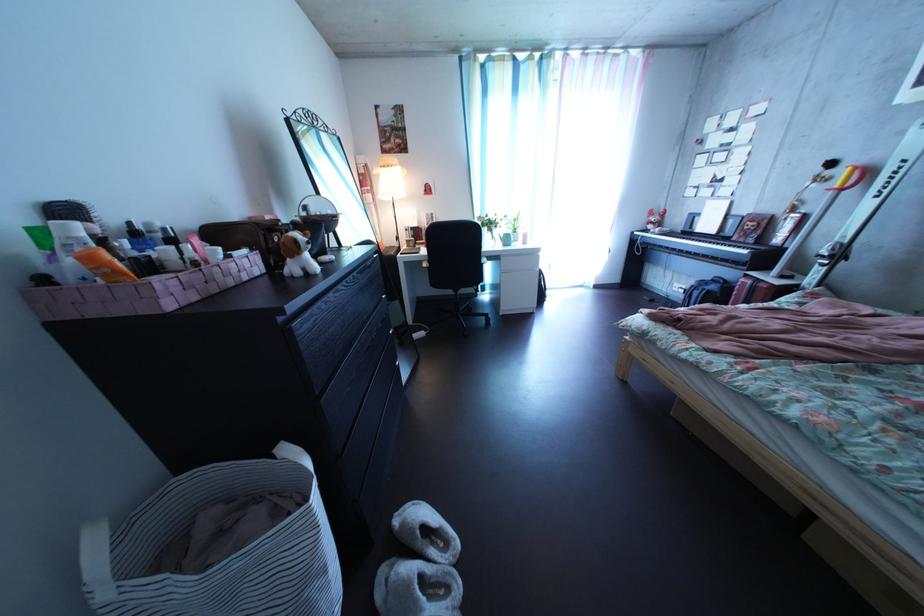
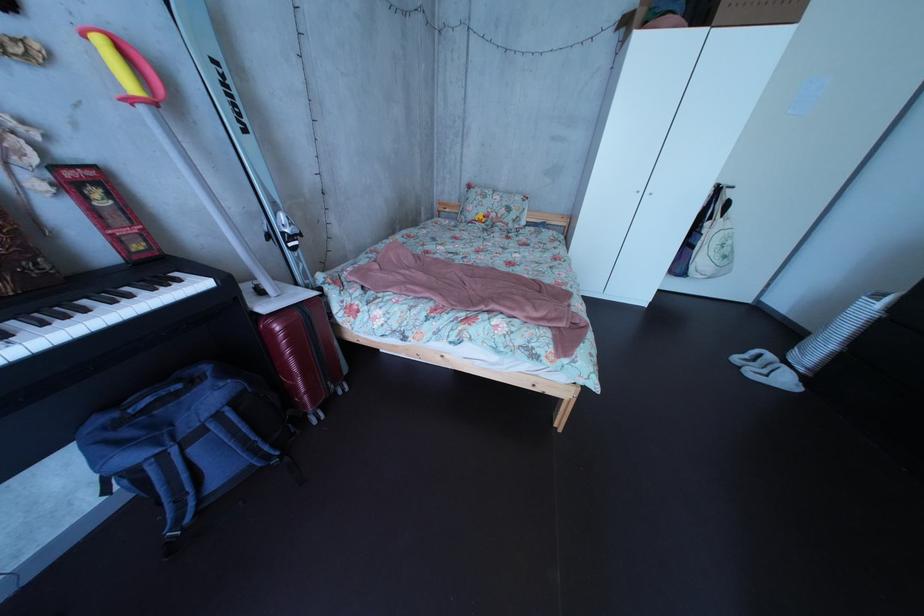
Where in the second image is the point corresponding to (x=865, y=177) from the first image?

(116, 51)